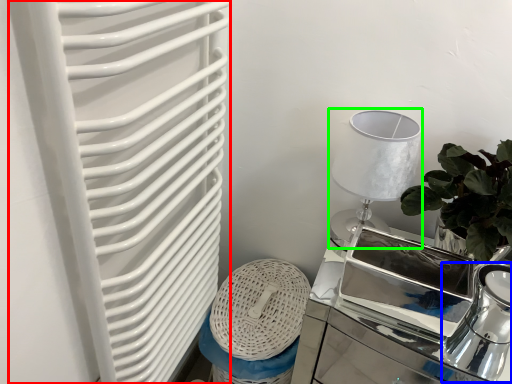
Question: Estimate the real-world distances between objects in this image. Which object is closer to radiator (highlighted by a red box), tea pot (highlighted by a blue box) or table lamp (highlighted by a green box)?

Choices:
 (A) tea pot
 (B) table lamp

Answer: (B)